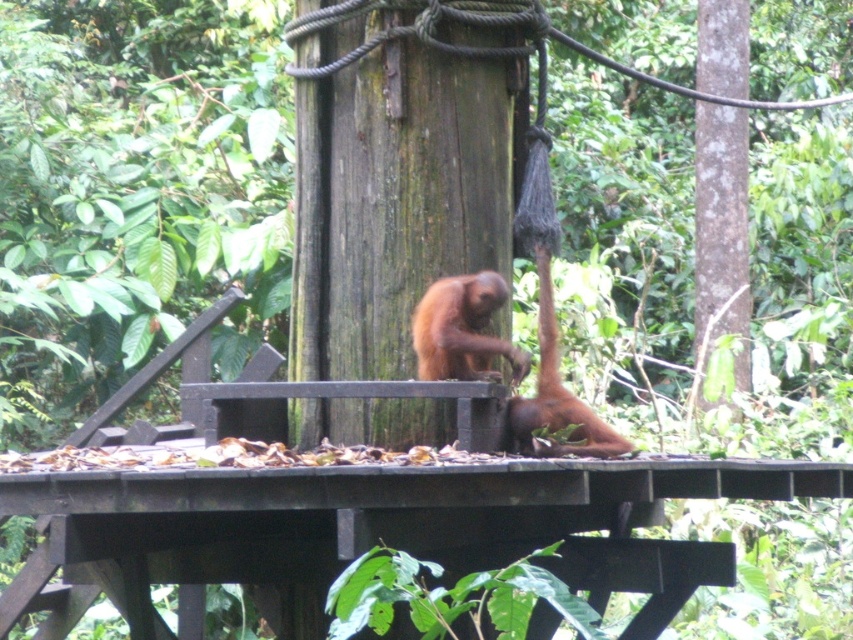
Question: Can you confirm if orange fur monkey at center is positioned above brown fur monkey at center?

Choices:
 (A) yes
 (B) no

Answer: (A)

Question: Does orange fur monkey at center have a smaller size compared to brown fur monkey at center?

Choices:
 (A) no
 (B) yes

Answer: (B)

Question: Is orange fur monkey at center thinner than brown fur monkey at center?

Choices:
 (A) yes
 (B) no

Answer: (B)

Question: Which of the following is the closest to the observer?

Choices:
 (A) (415, 328)
 (B) (541, 454)

Answer: (B)

Question: Which of the following is the closest to the observer?

Choices:
 (A) orange fur monkey at center
 (B) brown fur monkey at center

Answer: (B)